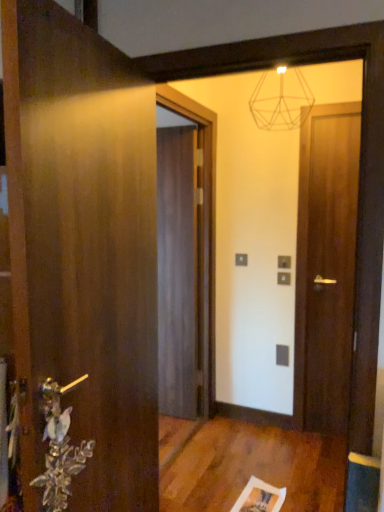
What is the approximate width of dark wood door at center, which is the third door in front-to-back order?

It is 5.43 inches.

You are a GUI agent. You are given a task and a screenshot of the screen. Output one action in this format:
    pyautogui.click(x=<x>, y=<y>)
    Task: Click on the wooden door at left, the 1th door in the left-to-right sequence
    The height and width of the screenshot is (512, 384).
    Given the screenshot: What is the action you would take?
    85,249

Based on the photo, does wooden door at left, the 1th door in the left-to-right sequence, have a greater width compared to dark wood door at center, placed as the first door when sorted from back to front?

Yes, wooden door at left, the 1th door in the left-to-right sequence, is wider than dark wood door at center, placed as the first door when sorted from back to front.

In the scene shown: From the image's perspective, between wooden door at left, the 1th door viewed from the front, and dark wood door at center, which is the third door in front-to-back order, which one is located above?

dark wood door at center, which is the third door in front-to-back order, from the image's perspective.

Is wooden door at left, the 1th door in the left-to-right sequence, positioned with its back to dark wood door at center, the second door positioned from the right?

No, wooden door at left, the 1th door in the left-to-right sequence, is not facing away from dark wood door at center, the second door positioned from the right.

Is dark wood door at center, which is the third door in front-to-back order, bigger than matte dark wood door at right, arranged as the third door when viewed from the left?

Correct, dark wood door at center, which is the third door in front-to-back order, is larger in size than matte dark wood door at right, arranged as the third door when viewed from the left.

Looking at this image, between dark wood door at center, placed as the first door when sorted from back to front, and matte dark wood door at right, arranged as the third door when viewed from the left, which one has less height?

dark wood door at center, placed as the first door when sorted from back to front, is shorter.

Is dark wood door at center, the second door positioned from the right, positioned before matte dark wood door at right, which is the 2th door from front to back?

No, it is not.

From a real-world perspective, which door is the 3rd one above the silver metallic door handle at lower left? Please provide its 2D coordinates.

[(85, 249)]

Is silver metallic door handle at lower left beside wooden door at left, the 3th door positioned from the right?

No.

What's the angular difference between silver metallic door handle at lower left and wooden door at left, the 1th door viewed from the front,'s facing directions?

0.271 degrees separate the facing orientations of silver metallic door handle at lower left and wooden door at left, the 1th door viewed from the front.

Does silver metallic door handle at lower left have a greater height compared to wooden door at left, the 3th door positioned from the right?

Incorrect, the height of silver metallic door handle at lower left is not larger of that of wooden door at left, the 3th door positioned from the right.

Considering the relative positions of silver metallic door handle at lower left and dark wood door at center, placed as the second door when sorted from left to right, in the image provided, is silver metallic door handle at lower left to the left of dark wood door at center, placed as the second door when sorted from left to right, from the viewer's perspective?

Yes, silver metallic door handle at lower left is to the left of dark wood door at center, placed as the second door when sorted from left to right.

Consider the image. From a real-world perspective, is silver metallic door handle at lower left positioned above or below dark wood door at center, the second door positioned from the right?

In terms of real-world spatial position, silver metallic door handle at lower left is below dark wood door at center, the second door positioned from the right.

Considering the relative sizes of silver metallic door handle at lower left and dark wood door at center, the second door positioned from the right, in the image provided, is silver metallic door handle at lower left bigger than dark wood door at center, the second door positioned from the right,?

Incorrect, silver metallic door handle at lower left is not larger than dark wood door at center, the second door positioned from the right.

Is silver metallic door handle at lower left oriented towards dark wood door at center, the second door positioned from the right?

No.

Between dark wood door at center, placed as the first door when sorted from back to front, and silver metallic door handle at lower left, which one has larger width?

With larger width is dark wood door at center, placed as the first door when sorted from back to front.

Is point (184, 130) behind point (65, 441)?

Yes.

How many degrees apart are the facing directions of dark wood door at center, placed as the second door when sorted from left to right, and silver metallic door handle at lower left?

The angular difference between dark wood door at center, placed as the second door when sorted from left to right, and silver metallic door handle at lower left is 95.9 degrees.

Is dark wood door at center, the second door positioned from the right, to the left of silver metallic door handle at lower left from the viewer's perspective?

No, dark wood door at center, the second door positioned from the right, is not to the left of silver metallic door handle at lower left.

Considering the relative sizes of wooden door at left, the 1th door in the left-to-right sequence, and matte dark wood door at right, which is the 2th door in back-to-front order, in the image provided, is wooden door at left, the 1th door in the left-to-right sequence, shorter than matte dark wood door at right, which is the 2th door in back-to-front order,?

Correct, wooden door at left, the 1th door in the left-to-right sequence, is not as tall as matte dark wood door at right, which is the 2th door in back-to-front order.

Is wooden door at left, the 1th door viewed from the front, spatially inside matte dark wood door at right, which is the 2th door from front to back, or outside of it?

wooden door at left, the 1th door viewed from the front, is located beyond the bounds of matte dark wood door at right, which is the 2th door from front to back.

Can you confirm if wooden door at left, the 1th door in the left-to-right sequence, is positioned to the left of matte dark wood door at right, which is the 2th door in back-to-front order?

Yes.

From the picture: Measure the distance from matte dark wood door at right, the 1th door viewed from the right, to dark wood door at center, which is the third door in front-to-back order.

matte dark wood door at right, the 1th door viewed from the right, is 82.49 centimeters from dark wood door at center, which is the third door in front-to-back order.

Between point (311, 389) and point (170, 183), which one is positioned in front?

The point (311, 389) is closer to the camera.

Consider the image. How different are the orientations of matte dark wood door at right, which is the 2th door in back-to-front order, and dark wood door at center, placed as the first door when sorted from back to front, in degrees?

There is a 0.615-degree angle between the facing directions of matte dark wood door at right, which is the 2th door in back-to-front order, and dark wood door at center, placed as the first door when sorted from back to front.

Which of these two, matte dark wood door at right, which is the 2th door in back-to-front order, or dark wood door at center, placed as the second door when sorted from left to right, is thinner?

Thinner between the two is matte dark wood door at right, which is the 2th door in back-to-front order.

Locate an element on the screen. The width and height of the screenshot is (384, 512). door below the dark wood door at center, which is the third door in front-to-back order (from the image's perspective) is located at coordinates (85, 249).

This screenshot has height=512, width=384. Find the location of `door behind the matte dark wood door at right, which is the 2th door in back-to-front order`. door behind the matte dark wood door at right, which is the 2th door in back-to-front order is located at coordinates (177, 271).

Considering their positions, is wooden door at left, the 1th door viewed from the front, positioned closer to dark wood door at center, the second door positioned from the right, than matte dark wood door at right, arranged as the third door when viewed from the left?

The object closer to dark wood door at center, the second door positioned from the right, is matte dark wood door at right, arranged as the third door when viewed from the left.

Considering their positions, is matte dark wood door at right, arranged as the third door when viewed from the left, positioned closer to silver metallic door handle at lower left than dark wood door at center, placed as the second door when sorted from left to right?

The object closer to silver metallic door handle at lower left is dark wood door at center, placed as the second door when sorted from left to right.

Considering their positions, is wooden door at left, the 1th door viewed from the front, positioned closer to silver metallic door handle at lower left than matte dark wood door at right, arranged as the third door when viewed from the left?

Among the two, wooden door at left, the 1th door viewed from the front, is located nearer to silver metallic door handle at lower left.

Looking at the image, which one is located further to dark wood door at center, the second door positioned from the right, silver metallic door handle at lower left or matte dark wood door at right, which is the 2th door from front to back?

Among the two, silver metallic door handle at lower left is located further to dark wood door at center, the second door positioned from the right.

From the image, which object appears to be farther from matte dark wood door at right, which is the 2th door in back-to-front order, silver metallic door handle at lower left or wooden door at left, the 1th door viewed from the front?

The object further to matte dark wood door at right, which is the 2th door in back-to-front order, is silver metallic door handle at lower left.

When comparing their distances from silver metallic door handle at lower left, does dark wood door at center, the second door positioned from the right, or wooden door at left, the 1th door viewed from the front, seem closer?

wooden door at left, the 1th door viewed from the front.

Estimate the real-world distances between objects in this image. Which object is closer to matte dark wood door at right, arranged as the third door when viewed from the left, silver metallic door handle at lower left or dark wood door at center, the second door positioned from the right?

Based on the image, dark wood door at center, the second door positioned from the right, appears to be nearer to matte dark wood door at right, arranged as the third door when viewed from the left.

When comparing their distances from silver metallic door handle at lower left, does wooden door at left, the 1th door in the left-to-right sequence, or dark wood door at center, placed as the second door when sorted from left to right, seem closer?

The object closer to silver metallic door handle at lower left is wooden door at left, the 1th door in the left-to-right sequence.

Image resolution: width=384 pixels, height=512 pixels. Find the location of `door located between silver metallic door handle at lower left and dark wood door at center, placed as the first door when sorted from back to front, in the depth direction`. door located between silver metallic door handle at lower left and dark wood door at center, placed as the first door when sorted from back to front, in the depth direction is located at coordinates (326, 266).

This screenshot has width=384, height=512. Identify the location of door handle between wooden door at left, the 1th door viewed from the front, and dark wood door at center, placed as the first door when sorted from back to front, along the z-axis. (59, 447).

The image size is (384, 512). I want to click on door between wooden door at left, the 1th door in the left-to-right sequence, and dark wood door at center, placed as the first door when sorted from back to front, along the z-axis, so click(326, 266).

Locate an element on the screen. The height and width of the screenshot is (512, 384). door handle located between wooden door at left, the 3th door when ordered from back to front, and matte dark wood door at right, which is the 2th door from front to back, in the depth direction is located at coordinates coord(59,447).